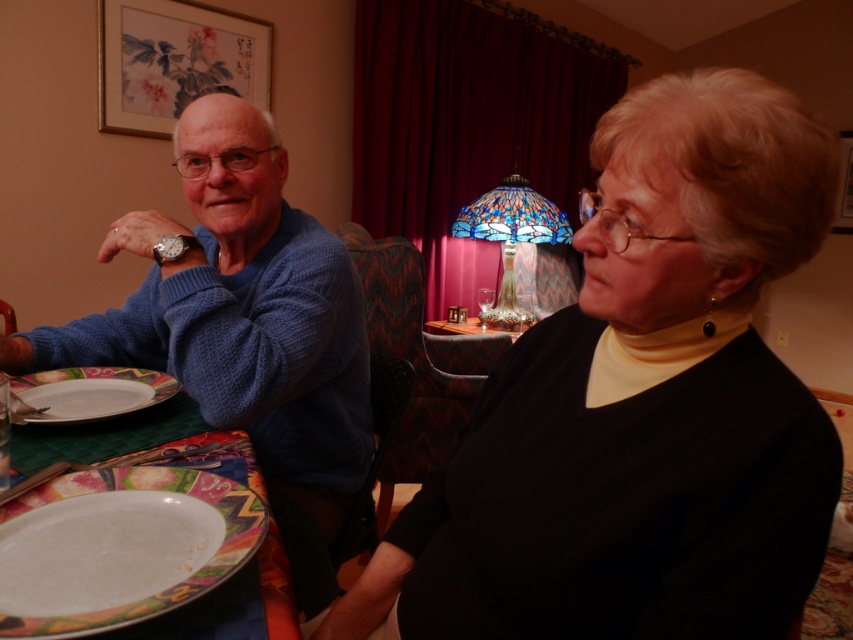
Consider the image. Is black matte dress at center to the left of blue knitted sweater at left from the viewer's perspective?

No, black matte dress at center is not to the left of blue knitted sweater at left.

Is black matte dress at center shorter than blue knitted sweater at left?

Correct, black matte dress at center is not as tall as blue knitted sweater at left.

Where is `black matte dress at center`? This screenshot has height=640, width=853. black matte dress at center is located at coordinates (640, 404).

Identify the location of black matte dress at center. The height and width of the screenshot is (640, 853). (640, 404).

Can you confirm if black matte dress at center is bigger than white glossy plate at lower left?

Yes.

Which is above, black matte dress at center or white glossy plate at lower left?

Positioned higher is black matte dress at center.

Locate an element on the screen. The width and height of the screenshot is (853, 640). black matte dress at center is located at coordinates (640, 404).

Which is above, blue knitted sweater at left or white glossy platter at lower left?

blue knitted sweater at left is above.

Is point (329, 417) more distant than point (125, 397)?

That is True.

Between point (160, 333) and point (71, 417), which one is positioned behind?

The point (160, 333) is more distant.

At what (x,y) coordinates should I click in order to perform the action: click on blue knitted sweater at left. Please return your answer as a coordinate pair (x, y). This screenshot has height=640, width=853. Looking at the image, I should click on (242, 326).